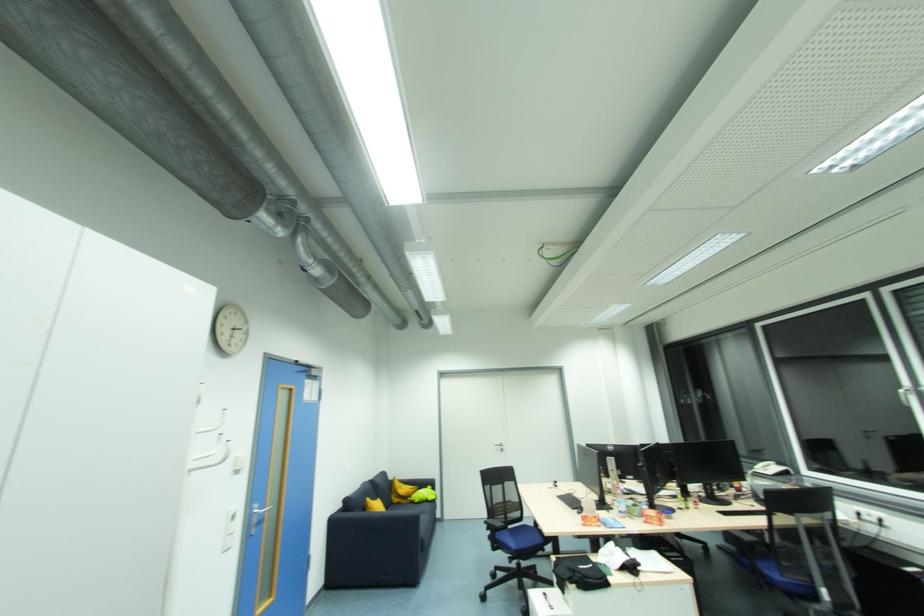
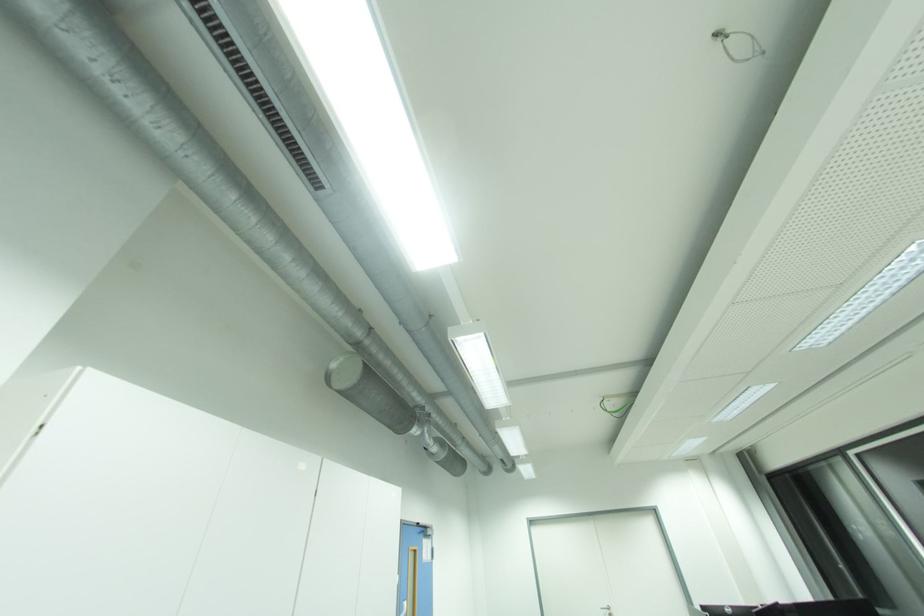
Question: What movement of the cameraman would produce the second image?

Choices:
 (A) Left
 (B) Right
 (C) Forward
 (D) Backward

Answer: (D)